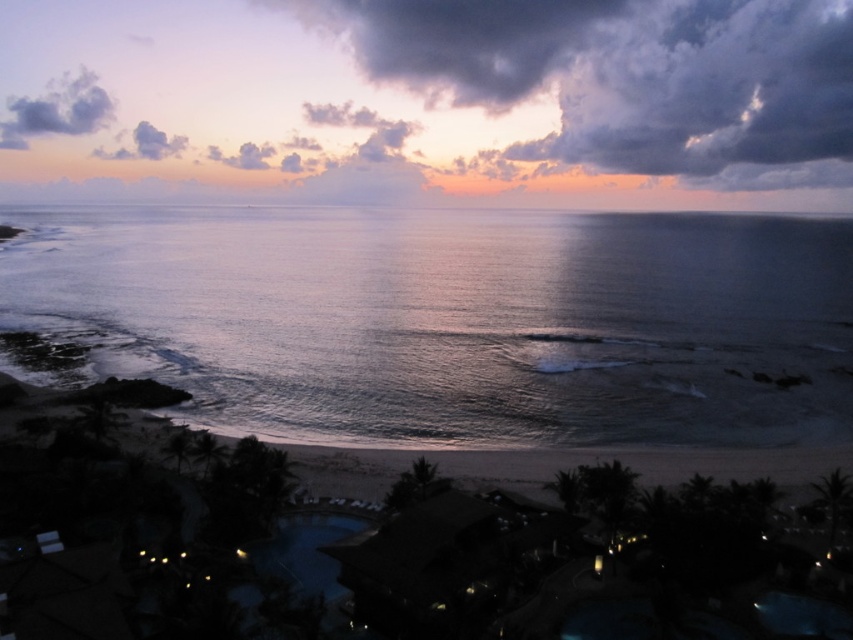
Does shiny blue water at center have a smaller size compared to dark gray cloud at upper left?

Incorrect, shiny blue water at center is not smaller in size than dark gray cloud at upper left.

Does shiny blue water at center have a lesser height compared to dark gray cloud at upper left?

Indeed, shiny blue water at center has a lesser height compared to dark gray cloud at upper left.

Is point (772, 241) closer to viewer compared to point (47, 84)?

Yes, point (772, 241) is in front of point (47, 84).

At what (x,y) coordinates should I click in order to perform the action: click on shiny blue water at center. Please return your answer as a coordinate pair (x, y). The height and width of the screenshot is (640, 853). Looking at the image, I should click on (454, 320).

The width and height of the screenshot is (853, 640). What do you see at coordinates (454, 320) in the screenshot?
I see `shiny blue water at center` at bounding box center [454, 320].

In the scene shown: Can you confirm if shiny blue water at center is thinner than purple cotton cloud at upper left?

No.

Locate an element on the screen. Image resolution: width=853 pixels, height=640 pixels. shiny blue water at center is located at coordinates (454, 320).

Is cloudy sky at upper center closer to camera compared to dark gray cloud at upper left?

Yes, it is in front of dark gray cloud at upper left.

Between point (619, 6) and point (57, 106), which one is positioned behind?

The point (57, 106) is behind.

Which is behind, point (663, 33) or point (9, 99)?

Point (9, 99)

Find the location of a particular element. The height and width of the screenshot is (640, 853). cloudy sky at upper center is located at coordinates (625, 81).